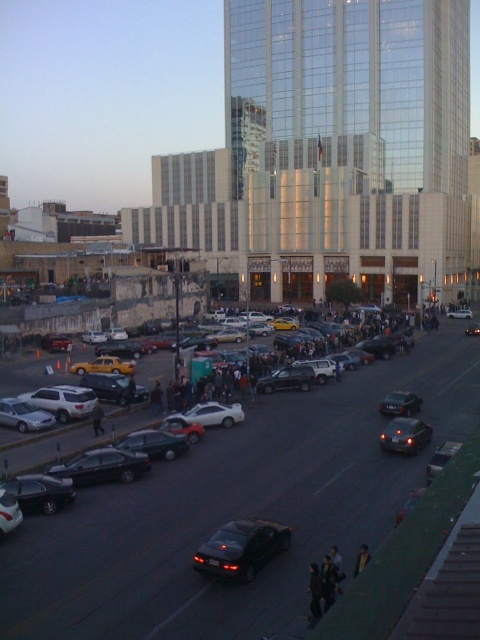
Question: Is black matte sedan at lower center further to the viewer compared to shiny black sedan at center?

Choices:
 (A) no
 (B) yes

Answer: (A)

Question: Is black matte sedan at lower center positioned behind white matte car at center?

Choices:
 (A) no
 (B) yes

Answer: (A)

Question: Among these objects, which one is farthest from the camera?

Choices:
 (A) satin black sedan at center
 (B) shiny silver sedan at center

Answer: (B)

Question: Considering the relative positions of shiny black sedan at lower left and shiny silver sedan at center in the image provided, where is shiny black sedan at lower left located with respect to shiny silver sedan at center?

Choices:
 (A) left
 (B) right

Answer: (A)

Question: Based on their relative distances, which object is nearer to the shiny black sedan at lower left?

Choices:
 (A) shiny black sedan at center
 (B) yellow matte taxi cab at lower left
 (C) white matte sedan at center
 (D) shiny silver sedan at center

Answer: (A)

Question: Which point is farther to the camera?

Choices:
 (A) (265, 544)
 (B) (72, 394)
 (C) (60, 570)

Answer: (B)